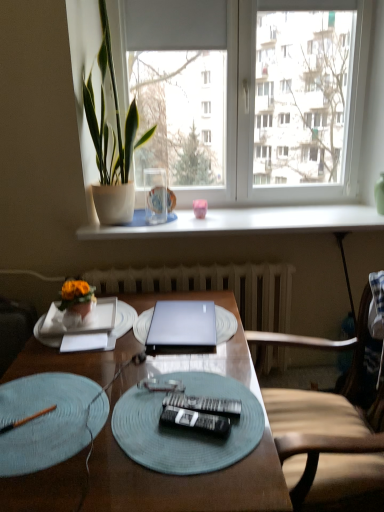
Locate an element on the screen. Image resolution: width=384 pixels, height=512 pixels. free space above matte green placemat at center (from a real-world perspective) is located at coordinates (190, 408).